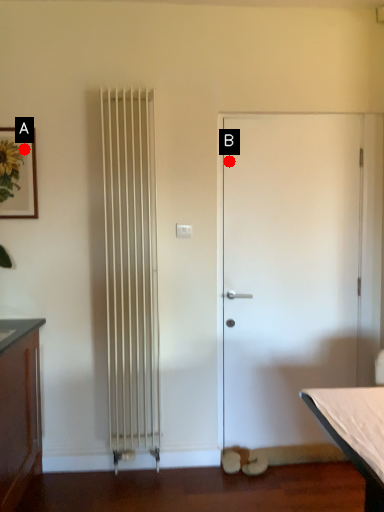
Question: Two points are circled on the image, labeled by A and B beside each circle. Which point is closer to the camera?

Choices:
 (A) A is closer
 (B) B is closer

Answer: (A)